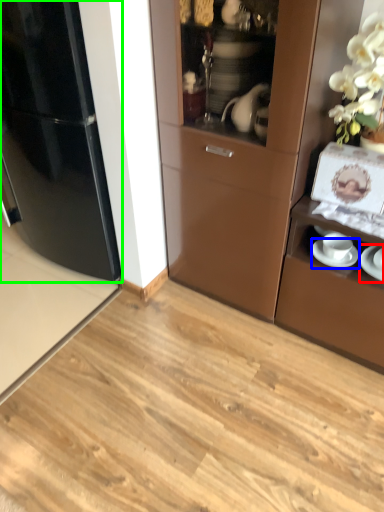
Question: Estimate the real-world distances between objects in this image. Which object is farther from saucer (highlighted by a red box), saucer (highlighted by a blue box) or refrigerator (highlighted by a green box)?

Choices:
 (A) saucer
 (B) refrigerator

Answer: (B)